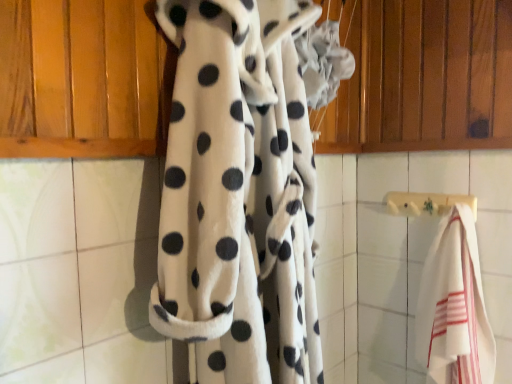
Question: Is white fleece blanket at center oriented towards white striped towel at right?

Choices:
 (A) yes
 (B) no

Answer: (B)

Question: Can you confirm if white fleece blanket at center is taller than white striped towel at right?

Choices:
 (A) yes
 (B) no

Answer: (A)

Question: Is white fleece blanket at center not close to white striped towel at right?

Choices:
 (A) yes
 (B) no

Answer: (B)

Question: From the image's perspective, would you say white fleece blanket at center is shown under white striped towel at right?

Choices:
 (A) yes
 (B) no

Answer: (B)

Question: Is white fleece blanket at center further to the viewer compared to white striped towel at right?

Choices:
 (A) no
 (B) yes

Answer: (A)

Question: Is white striped towel at right to the left or to the right of white fleece blanket at center in the image?

Choices:
 (A) left
 (B) right

Answer: (B)

Question: From the image's perspective, relative to white fleece blanket at center, is white striped towel at right above or below?

Choices:
 (A) above
 (B) below

Answer: (B)

Question: Is white striped towel at right wider or thinner than white fleece blanket at center?

Choices:
 (A) thin
 (B) wide

Answer: (A)

Question: Is point (455, 218) closer or farther from the camera than point (207, 268)?

Choices:
 (A) closer
 (B) farther

Answer: (B)

Question: From the image's perspective, is wooden towel bar at center positioned above or below white fleece blanket at center?

Choices:
 (A) below
 (B) above

Answer: (A)

Question: Is wooden towel bar at center spatially inside white fleece blanket at center, or outside of it?

Choices:
 (A) inside
 (B) outside

Answer: (B)

Question: Is point (399, 195) closer or farther from the camera than point (169, 148)?

Choices:
 (A) farther
 (B) closer

Answer: (A)

Question: From a real-world perspective, relative to white fleece blanket at center, is wooden towel bar at center vertically above or below?

Choices:
 (A) above
 (B) below

Answer: (B)

Question: From the image's perspective, is white fleece blanket at center located above or below wooden towel bar at center?

Choices:
 (A) below
 (B) above

Answer: (B)

Question: Considering their positions, is white fleece blanket at center located in front of or behind wooden towel bar at center?

Choices:
 (A) behind
 (B) front

Answer: (B)